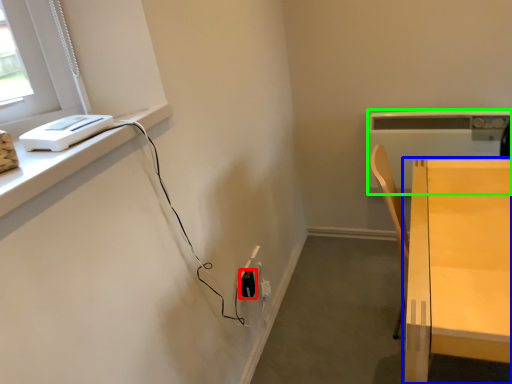
Question: Estimate the real-world distances between objects in this image. Which object is farther from electric outlet (highlighted by a red box), table (highlighted by a blue box) or appliance (highlighted by a green box)?

Choices:
 (A) table
 (B) appliance

Answer: (B)